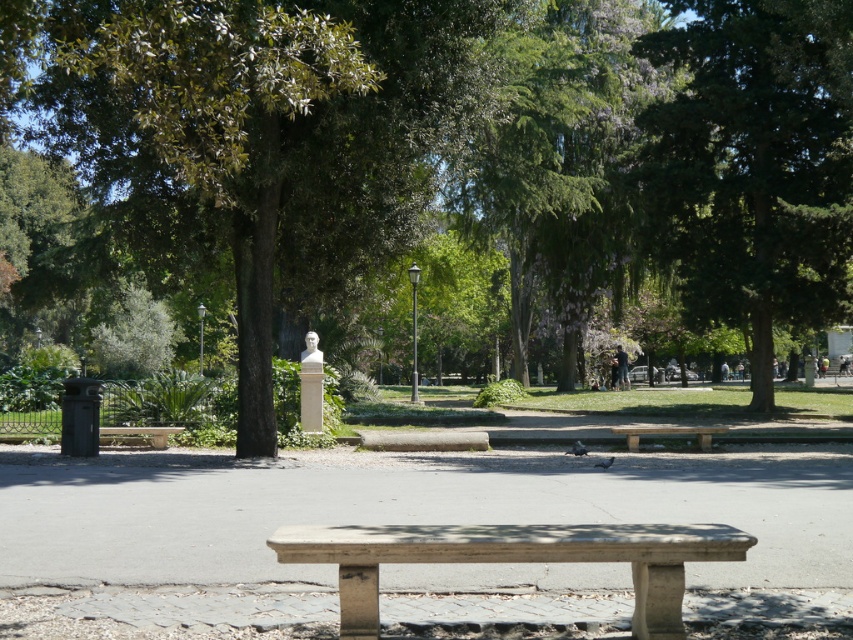
Question: Based on their relative distances, which object is nearer to the stone bench at center?

Choices:
 (A) smooth stone bench at center
 (B) green leafy tree at center

Answer: (A)

Question: Can you confirm if green leafy tree at center is bigger than light brown stone bench at center?

Choices:
 (A) no
 (B) yes

Answer: (B)

Question: Which point is farther to the camera?

Choices:
 (A) (651, 620)
 (B) (776, 131)
 (C) (628, 428)

Answer: (B)

Question: Is smooth stone bench at center bigger than light brown stone bench at center?

Choices:
 (A) yes
 (B) no

Answer: (B)

Question: Which point is farther to the camera?

Choices:
 (A) (152, 436)
 (B) (636, 442)
 (C) (251, 387)

Answer: (B)

Question: Is green leafy tree at center further to camera compared to green leafy tree at upper right?

Choices:
 (A) no
 (B) yes

Answer: (A)